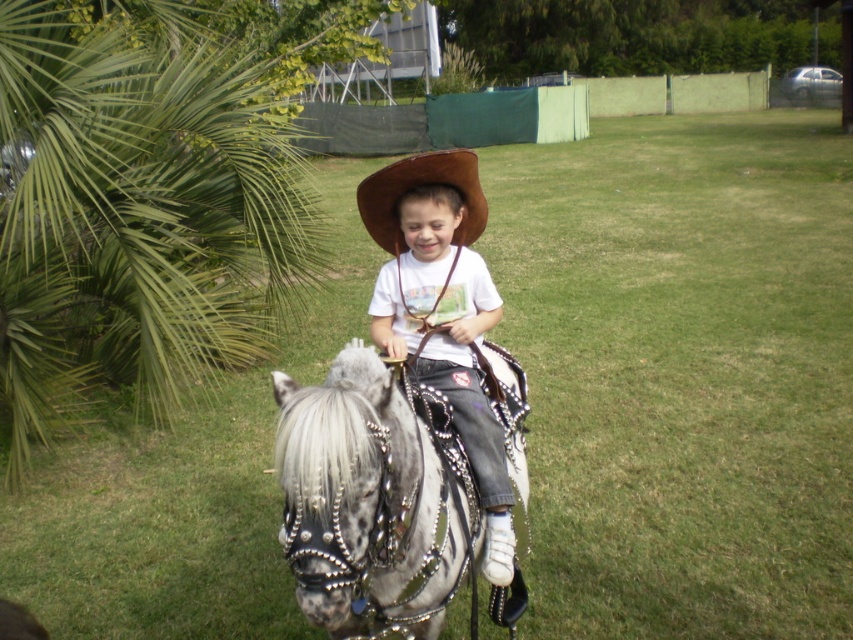
Can you confirm if green leafy palm at left is thinner than speckled metallic horse at center?

Incorrect, green leafy palm at left's width is not less than speckled metallic horse at center's.

Does point (239, 324) lie in front of point (299, 493)?

No.

I want to click on green leafy palm at left, so click(135, 218).

Who is positioned more to the right, matte brown cowboy hat at center or brown leather cowboy hat at center?

brown leather cowboy hat at center is more to the right.

Between point (502, 484) and point (480, 202), which one is positioned behind?

Positioned behind is point (480, 202).

Does point (492, 296) come in front of point (367, 179)?

No, (492, 296) is further to viewer.

This screenshot has width=853, height=640. Find the location of `matte brown cowboy hat at center`. matte brown cowboy hat at center is located at coordinates (442, 310).

Does point (173, 68) come in front of point (465, 177)?

No, (173, 68) is further to viewer.

Who is more distant from viewer, [165,200] or [476,228]?

The point [165,200] is behind.

The width and height of the screenshot is (853, 640). In order to click on green leafy palm at left in this screenshot , I will do `click(135, 218)`.